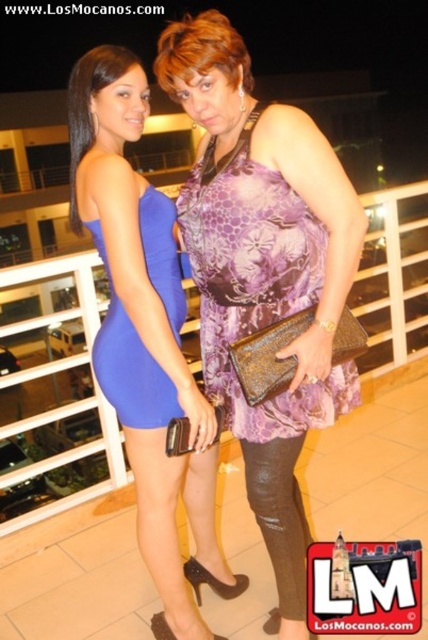
In the scene shown: You are a photographer trying to capture the best angle of the two women on the balcony. Since you want to highlight both the purple floral fabric dress at center and the leather textured leggings at lower center, which one should you focus on first to ensure both are in frame?

The purple floral fabric dress at center is above the leather textured leggings at lower center, so you should focus on the purple floral fabric dress at center first to ensure both are in frame.

Consider the image. You are a photographer trying to capture the blue satin dress at center in the image. Given that the camera is focused on the point at coordinates point (145, 336), will the blue satin dress at center be in focus?

Yes, the blue satin dress at center is located exactly at point (145, 336), so it will be in focus.

You are a photographer setting up for a night shoot on a balcony. You need to ensure that both the blue satin dress at center and the purple floral fabric dress at center are visible in the frame. Based on their positions, which dress should you focus on first to ensure both are in focus?

The blue satin dress at center is in front of the purple floral fabric dress at center, so you should focus on the blue satin dress at center first to ensure both are in focus.